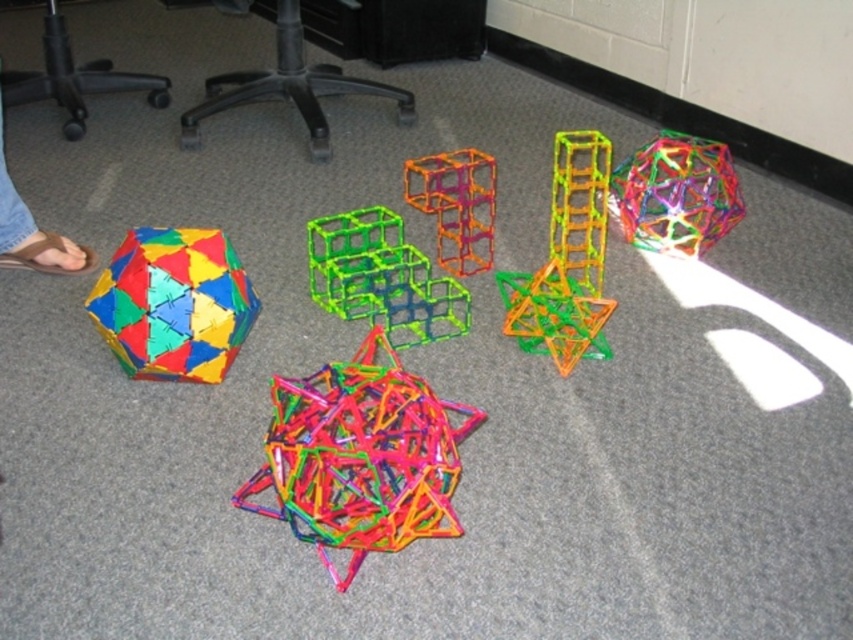
You are a child trying to build a tower using the translucent green plastic cube at center and the translucent orange cube at center. Which cube should you place first to have the green cube on the left side of the orange cube in the final tower?

You should place the translucent green plastic cube at center first because it needs to be to the left of the translucent orange cube at center in the final tower.

You are a child trying to fit the translucent plastic star at center into a box that can only hold items narrower than the translucent green plastic cube at center. Will the star fit?

The translucent plastic star at center is wider than the translucent green plastic cube at center, so it won not fit into the box designed for items narrower than the cube.

You are looking at the geometric structures from above. There are two points marked in the image, point A at coordinates point (415, 291) and point B at coordinates point (474, 228). Which point is closer to your viewpoint?

Point A at coordinates point (415, 291) is closer to the camera than point B at coordinates point (474, 228).